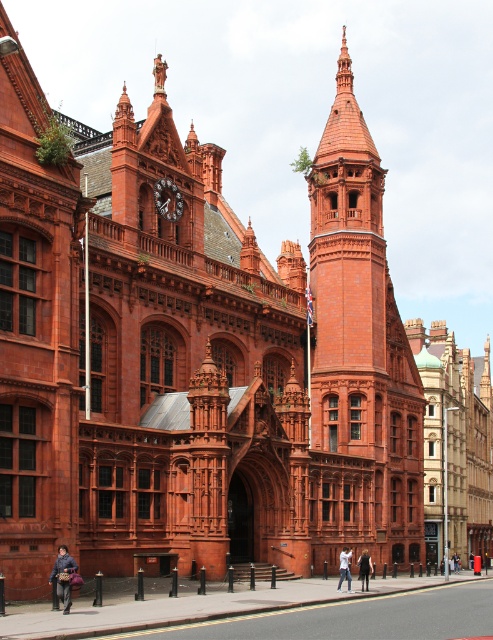
Question: Which point is farther from the camera taking this photo?

Choices:
 (A) (66, 612)
 (B) (394, 460)
 (C) (367, 586)

Answer: (B)

Question: Among these points, which one is nearest to the camera?

Choices:
 (A) tap(365, 570)
 (B) tap(344, 552)
 (C) tap(343, 140)
 (D) tap(57, 589)

Answer: (D)

Question: Can you confirm if metallic clock face at upper center is positioned to the left of white cotton shirt at center?

Choices:
 (A) no
 (B) yes

Answer: (B)

Question: Is metallic clock face at upper center closer to camera compared to dark gray fabric coat at center?

Choices:
 (A) yes
 (B) no

Answer: (B)

Question: Does matte brick tower at center lie in front of leather jacket at lower left?

Choices:
 (A) no
 (B) yes

Answer: (A)

Question: Which point appears farthest from the camera in this image?

Choices:
 (A) (341, 564)
 (B) (75, 568)

Answer: (A)